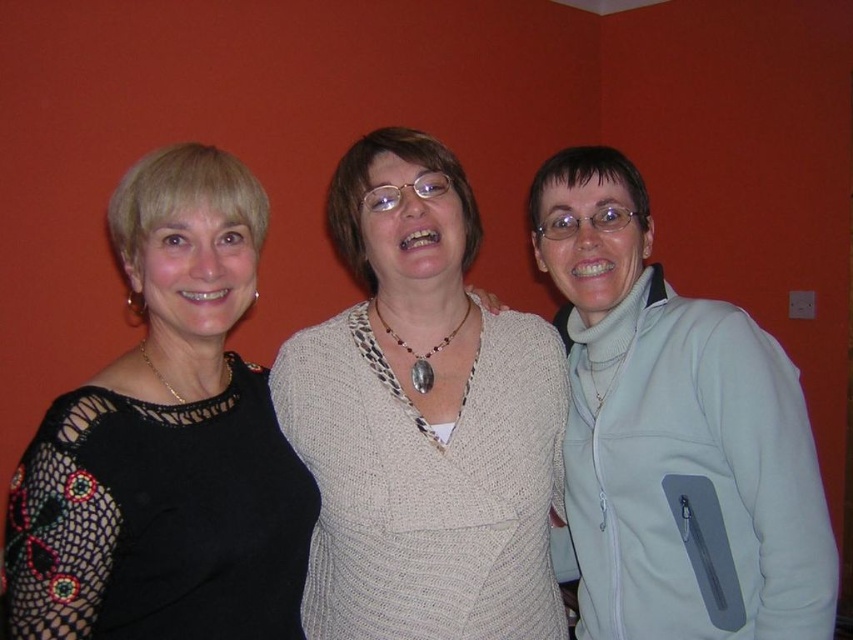
You are standing in front of the three people against the red wall. You notice two points marked on the image. The first point is at coordinates point (434, 598) and the second is at point (647, 566). Which point is closer to you?

Point (434, 598) is in front of point (647, 566), so it is closer to you.

You are standing in front of the image and want to describe the location of the white knitted sweater at center. What are its coordinates?

The white knitted sweater at center is located at coordinates point (x=422, y=419).

From the picture: You are a photographer who wants to ensure all subjects are visible in a group photo. Given the positions of the black lace dress at left and the light blue fleece jacket at right, which subject should you focus on to capture both the highest and lowest points of the group?

The black lace dress at left is above the light blue fleece jacket at right, so focusing on the center subject would ensure both the highest and lowest points are captured.